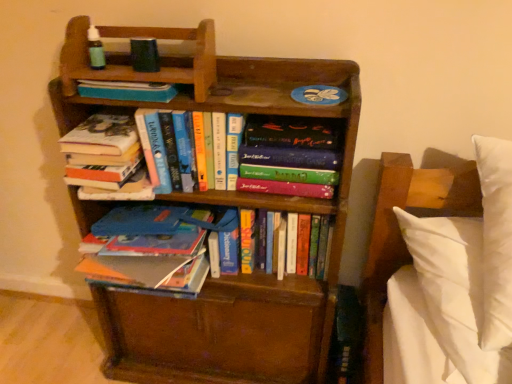
Question: From the image's perspective, is hardcover book at upper center, positioned as the fourth book in right-to-left order, located above or below wooden bookcase at center?

Choices:
 (A) above
 (B) below

Answer: (A)

Question: From their relative heights in the image, would you say hardcover book at upper center, the 2th book positioned from the left, is taller or shorter than wooden bookcase at center?

Choices:
 (A) tall
 (B) short

Answer: (B)

Question: Which is farther from the hardcover books at center, which is the first book from left to right?

Choices:
 (A) hardcover book at center, acting as the 3th book starting from the left
 (B) hardcover book at center, the 5th book when ordered from left to right
 (C) hardcover book at upper center, the 2th book positioned from the left
 (D) wooden bookcase at center
 (E) hardcover book at center, the 2th book positioned from the right

Answer: (E)

Question: Which of these objects is positioned farthest from the hardcover books at center, the fifth book from the right?

Choices:
 (A) hardcover book at center, placed as the third book when sorted from right to left
 (B) hardcover book at center, the 5th book when ordered from left to right
 (C) hardcover book at center, which appears as the fourth book when viewed from the left
 (D) hardcover book at upper center, the 2th book positioned from the left
 (E) wooden bookcase at center

Answer: (C)